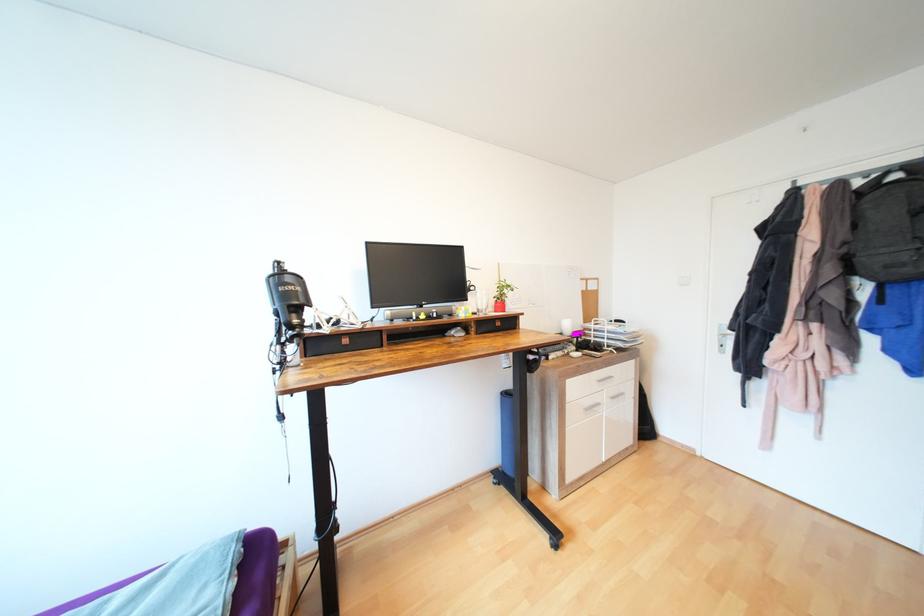
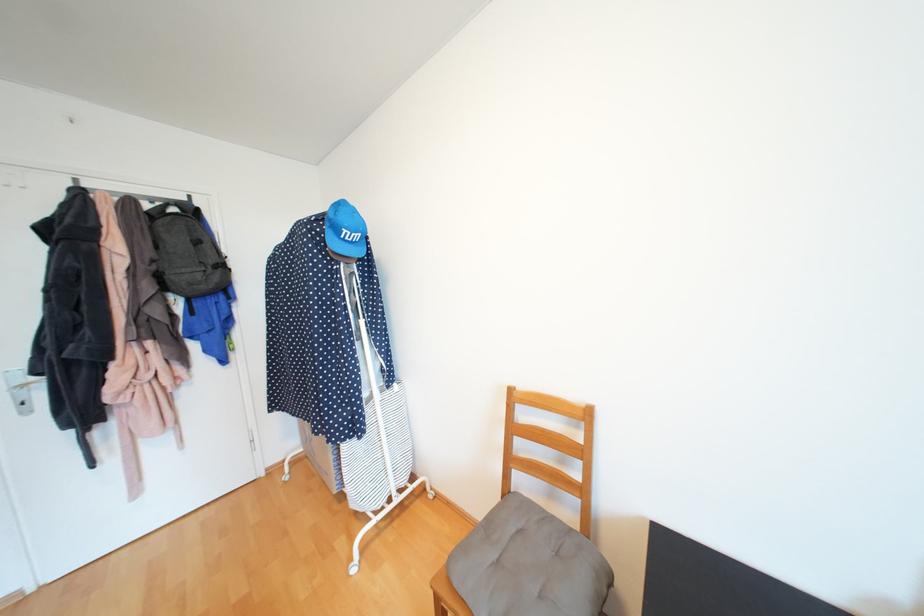
The point at (x=850, y=244) is marked in the first image. Where is the corresponding point in the second image?

(160, 262)